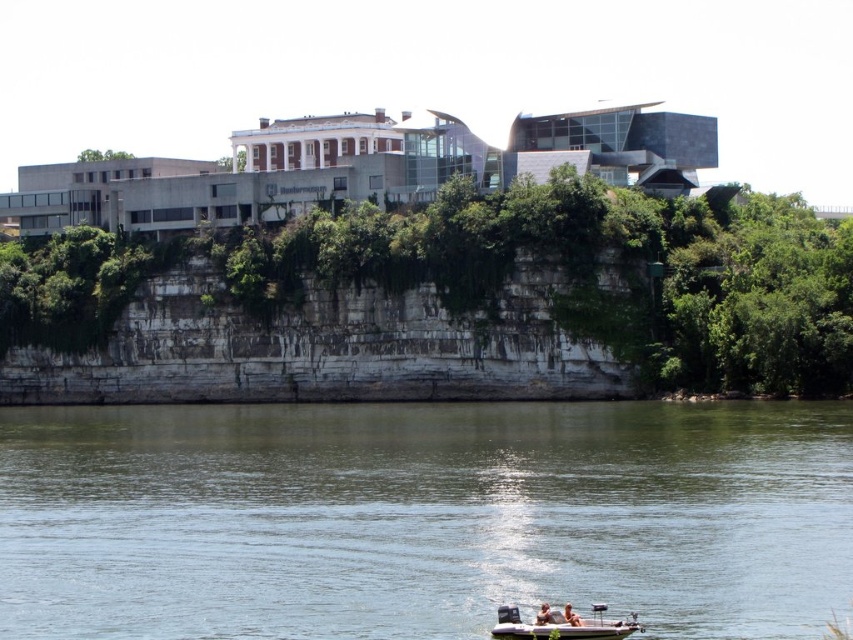
From the picture: Who is shorter, greenish water at lower center or white plastic boat at lower center?

Standing shorter between the two is white plastic boat at lower center.

Does greenish water at lower center appear under white plastic boat at lower center?

Actually, greenish water at lower center is above white plastic boat at lower center.

This screenshot has height=640, width=853. I want to click on greenish water at lower center, so click(422, 516).

Who is positioned more to the right, white plastic boat at lower center or light brown wooden boat at lower center?

From the viewer's perspective, light brown wooden boat at lower center appears more on the right side.

Between point (579, 625) and point (566, 609), which one is positioned behind?

Point (566, 609)

In order to click on white plastic boat at lower center in this screenshot , I will do `click(561, 624)`.

What do you see at coordinates (422, 516) in the screenshot?
I see `greenish water at lower center` at bounding box center [422, 516].

Which is more to the right, greenish water at lower center or light brown wooden boat at lower center?

From the viewer's perspective, light brown wooden boat at lower center appears more on the right side.

Between point (180, 509) and point (567, 608), which one is positioned in front?

Point (567, 608) is in front.

Identify the location of greenish water at lower center. The height and width of the screenshot is (640, 853). (422, 516).